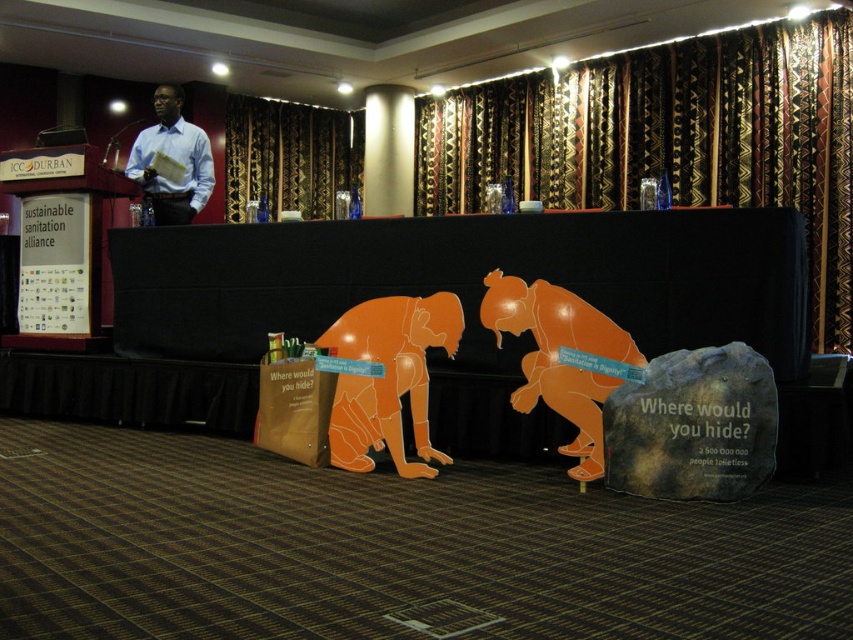
Question: Considering the real-world distances, which object is farthest from the brown paper bag at lower center?

Choices:
 (A) blue shirt at upper left
 (B) patterned fabric curtain at upper center
 (C) velvet-like dark brown curtain at upper center

Answer: (C)

Question: Which object is positioned closest to the blue shirt at upper left?

Choices:
 (A) patterned fabric curtain at upper center
 (B) velvet-like dark brown curtain at upper center

Answer: (B)

Question: From the image, what is the correct spatial relationship of patterned fabric curtain at upper center in relation to blue shirt at upper left?

Choices:
 (A) left
 (B) right

Answer: (B)

Question: Which point appears closest to the camera in this image?

Choices:
 (A) (300, 180)
 (B) (128, 177)
 (C) (277, 394)

Answer: (C)

Question: In this image, where is velvet-like dark brown curtain at upper center located relative to blue shirt at upper left?

Choices:
 (A) right
 (B) left

Answer: (A)

Question: Where is patterned fabric curtain at upper center located in relation to blue shirt at upper left in the image?

Choices:
 (A) below
 (B) above

Answer: (B)